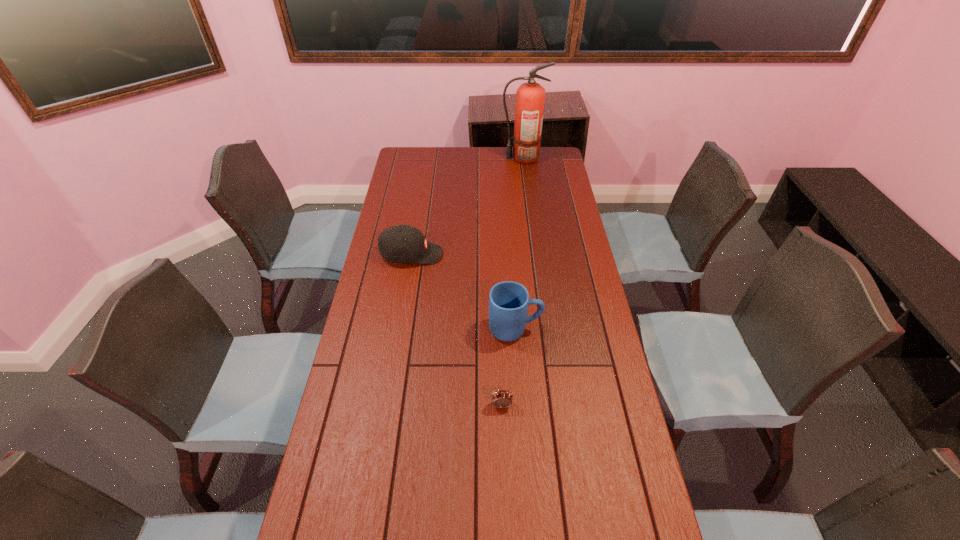
This screenshot has height=540, width=960. I want to click on vacant area that lies between the shortest object and the leftmost object, so click(457, 329).

Image resolution: width=960 pixels, height=540 pixels. What are the coordinates of `free space between the alarm clock and the baseball cap` in the screenshot? It's located at (457, 329).

Locate an element on the screen. empty location between the fire extinguisher and the leftmost object is located at coordinates (467, 206).

The width and height of the screenshot is (960, 540). What are the coordinates of `vacant area between the baseball cap and the mug` in the screenshot? It's located at (463, 292).

Locate an element on the screen. The height and width of the screenshot is (540, 960). empty space that is in between the second shortest object and the fire extinguisher is located at coordinates (467, 206).

Locate an element on the screen. vacant space that is in between the leftmost object and the alarm clock is located at coordinates (457, 329).

This screenshot has height=540, width=960. In order to click on object that is the third closest to the fire extinguisher in this screenshot , I will do `click(502, 398)`.

Locate which object ranks third in proximity to the alarm clock. Please provide its 2D coordinates. Your answer should be formatted as a tuple, i.e. [(x, y)], where the tuple contains the x and y coordinates of a point satisfying the conditions above.

[(530, 97)]

At what (x,y) coordinates should I click in order to perform the action: click on vacant space that satisfies the following two spatial constraints: 1. on the nozzle of the farthest object; 2. on the face of the alarm clock. Please return your answer as a coordinate pair (x, y). The width and height of the screenshot is (960, 540). Looking at the image, I should click on (555, 405).

This screenshot has width=960, height=540. Identify the location of free spot that satisfies the following two spatial constraints: 1. on the side of the second tallest object with the handle; 2. on the face of the alarm clock. (520, 405).